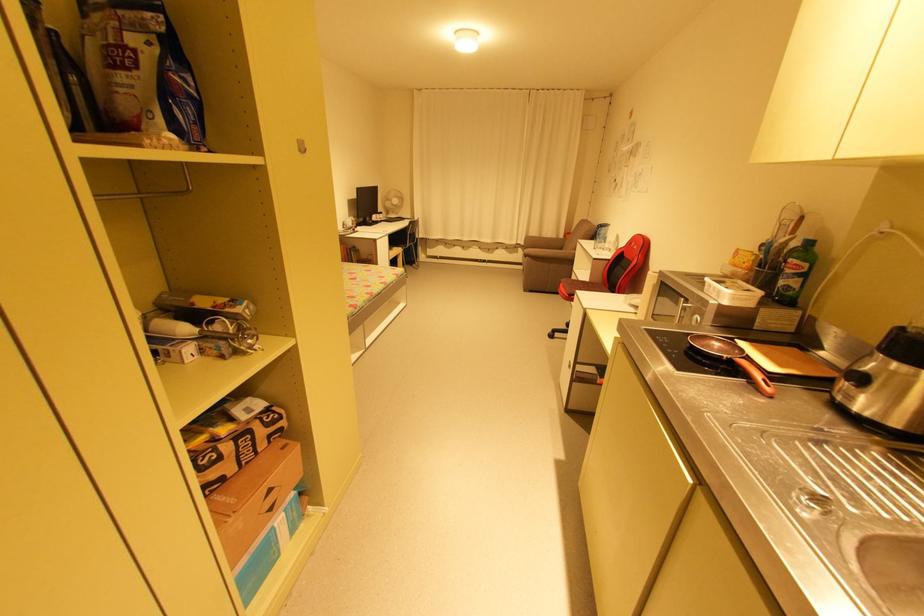
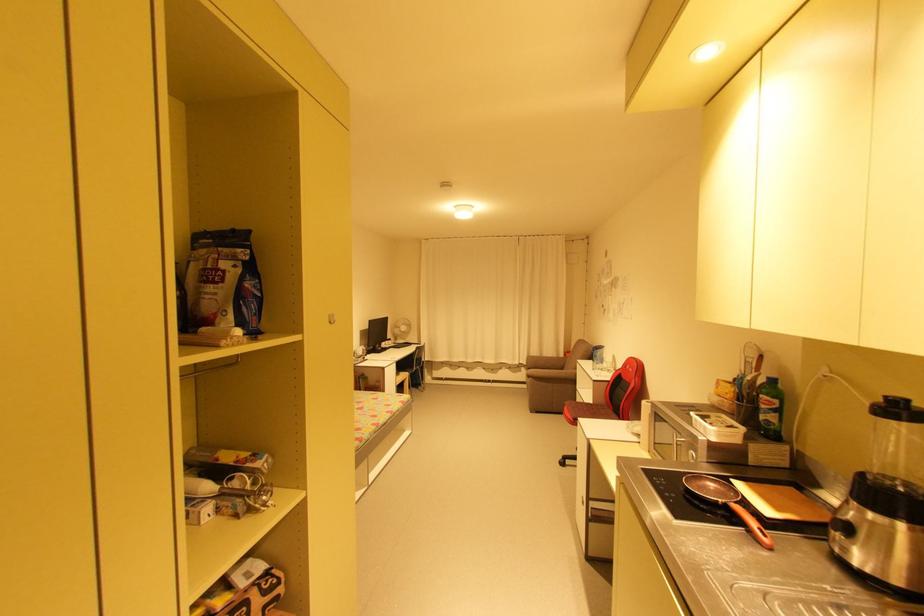
In the second image, find the point that corresponds to (132,70) in the first image.

(220, 283)